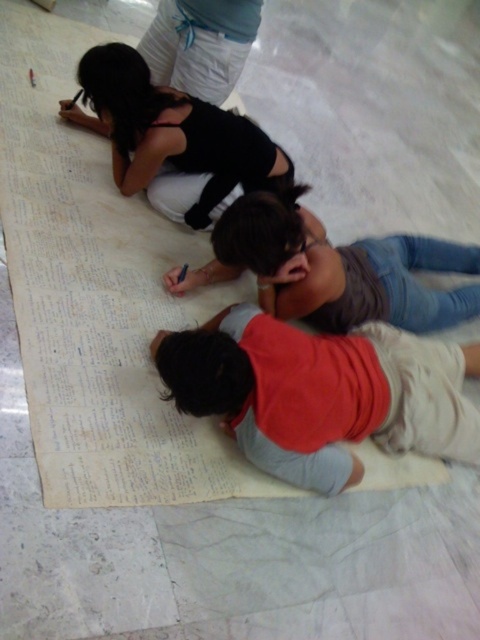
You are a photographer standing in the scene and want to take a photo of both the red cotton shirt at lower center and the matte black top at upper left. Can you see both subjects clearly without any obstruction?

Yes, the red cotton shirt at lower center is in front of matte black top at upper left, so the photographer can see both subjects clearly as there is no obstruction between them.

You are an observer looking at the scene of three people on a large sheet of paper. Which object takes up more space on the paper between the red cotton shirt at lower center and the matte gray shirt at center?

The matte gray shirt at center occupies more space on the paper than the red cotton shirt at lower center according to the description.

You are standing in front of the collaborative writing scene. There are two points marked on the paper at coordinates point [310,291] and point [87,51]. Which point is closer to you?

Point [310,291] is closer to the viewer than point [87,51].